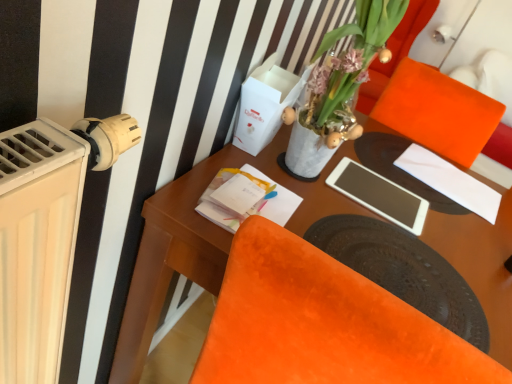
This screenshot has height=384, width=512. I want to click on empty space that is ontop of wooden desk at center, so click(413, 221).